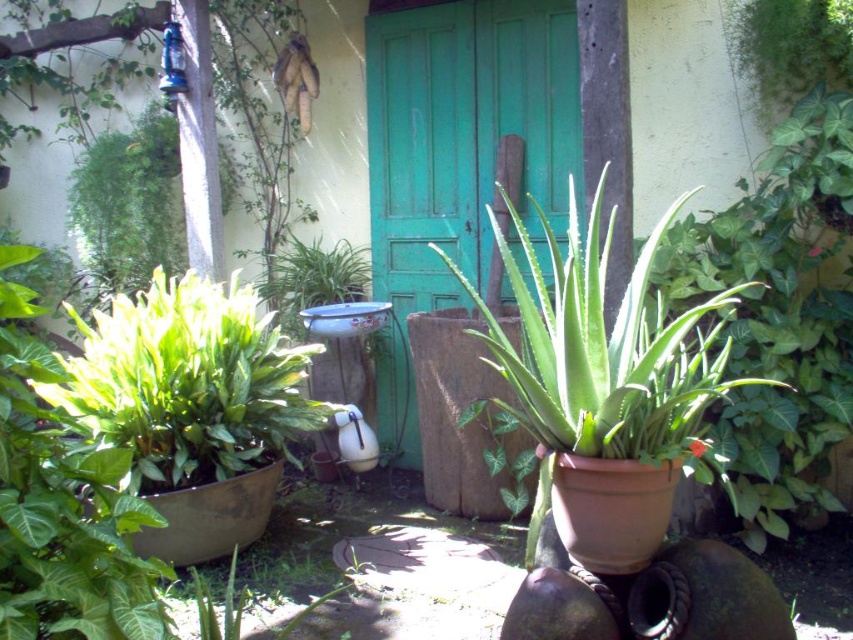
Question: Which object is the closest to the green glossy leafy plant at left?

Choices:
 (A) green matte plant at center
 (B) green wooden door at center

Answer: (A)

Question: Which of the following is the closest to the observer?

Choices:
 (A) green wooden door at center
 (B) green matte plant at center

Answer: (B)

Question: Considering the relative positions of green matte plant at center and green glossy leafy plant at left in the image provided, where is green matte plant at center located with respect to green glossy leafy plant at left?

Choices:
 (A) below
 (B) above

Answer: (B)

Question: Is green wooden door at center wider than green glossy leafy plant at left?

Choices:
 (A) no
 (B) yes

Answer: (B)

Question: Can you confirm if green wooden door at center is positioned to the left of green matte plant at center?

Choices:
 (A) yes
 (B) no

Answer: (A)

Question: Among these objects, which one is nearest to the camera?

Choices:
 (A) green glossy leafy plant at left
 (B) green wooden door at center

Answer: (A)